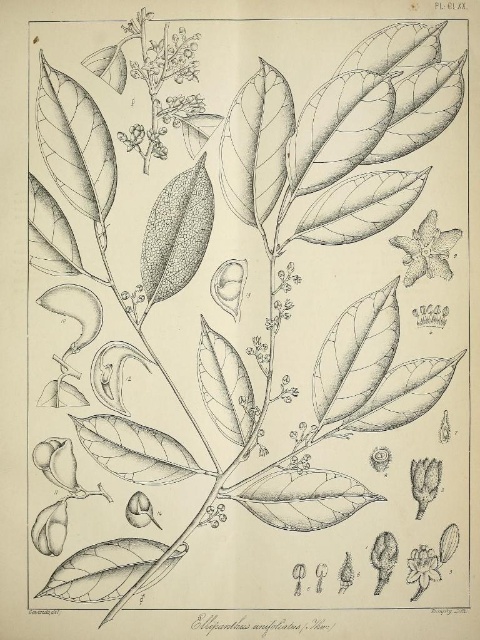
You are an entomologist examining the botanical illustration of Elaeocarpus unifoliatus. You need to locate the smooth white flower at upper right. According to the illustration, what are the coordinates of its position?

The smooth white flower at upper right is located at coordinates [427,250].

You are an artist examining the botanical illustration of Elaeocarpus unifoliatus. You notice two white flowers in the image. Which one, the smooth white flower at upper right or the white paper flower at lower right, is taller?

The smooth white flower at upper right is taller than the white paper flower at lower right.